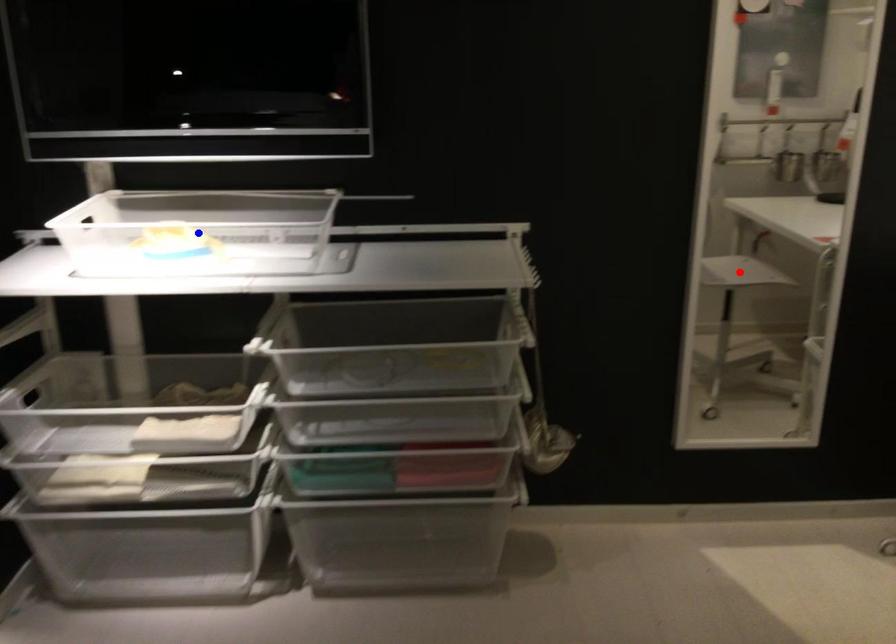
Question: Two points are marked on the image. Which point is closer to the camera?

Choices:
 (A) Blue point is closer.
 (B) Red point is closer.

Answer: (A)